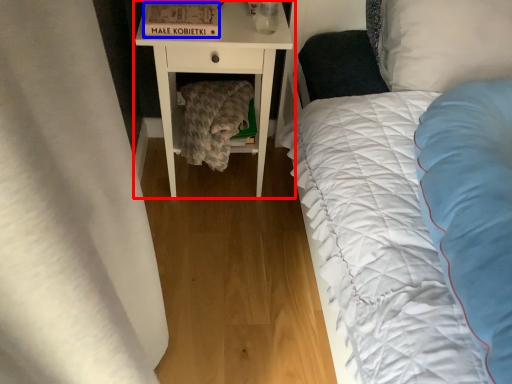
Question: Which point is closer to the camera, nightstand (highlighted by a red box) or cardboard box (highlighted by a blue box)?

Choices:
 (A) nightstand
 (B) cardboard box

Answer: (B)